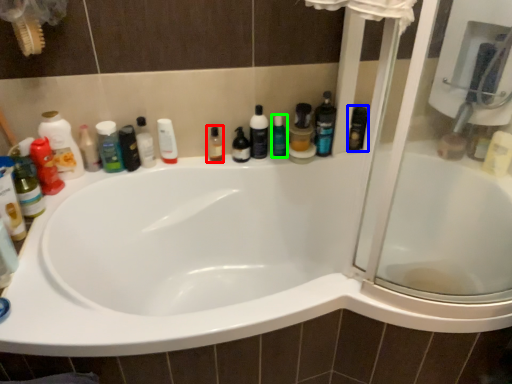
Question: Estimate the real-world distances between objects in this image. Which object is closer to toiletry (highlighted by a red box), toiletry (highlighted by a blue box) or cleaning product (highlighted by a green box)?

Choices:
 (A) toiletry
 (B) cleaning product

Answer: (B)